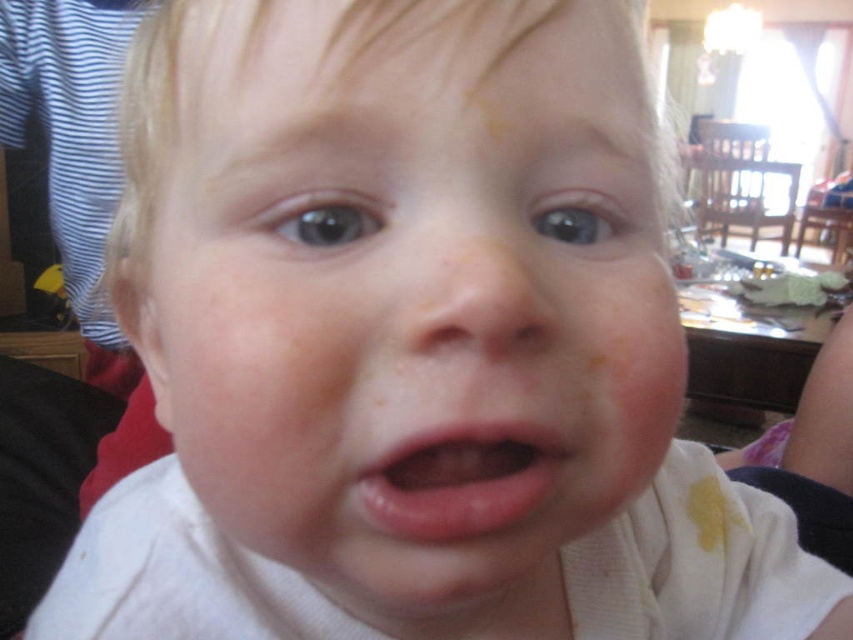
Question: Which point appears closest to the camera in this image?

Choices:
 (A) (280, 248)
 (B) (508, 488)

Answer: (B)

Question: Is smooth skin face at center to the left of pink smooth lips at center from the viewer's perspective?

Choices:
 (A) no
 (B) yes

Answer: (B)

Question: Observing the image, what is the correct spatial positioning of smooth skin face at center in reference to pink smooth lips at center?

Choices:
 (A) right
 (B) left

Answer: (B)

Question: Is smooth skin face at center positioned in front of pink smooth lips at center?

Choices:
 (A) yes
 (B) no

Answer: (A)